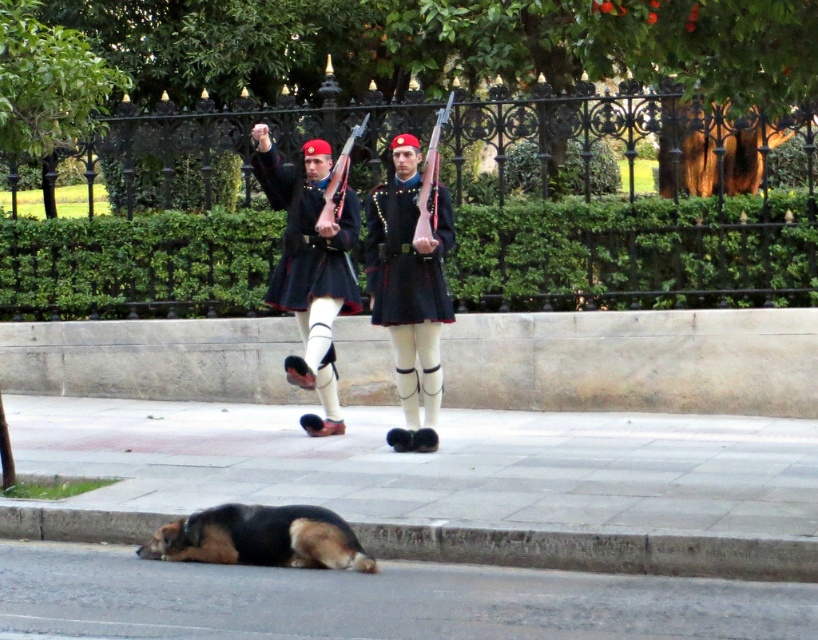
Question: Can you confirm if gray concrete curb at lower center is bigger than matte black uniform at center?

Choices:
 (A) yes
 (B) no

Answer: (B)

Question: Which of the following is the farthest from the observer?

Choices:
 (A) dark blue uniform at center
 (B) brown asphalt at lower center
 (C) brown fur dog at lower center
 (D) matte black uniform at center

Answer: (D)

Question: Which object is positioned closest to the brown fur dog at lower center?

Choices:
 (A) gray concrete curb at lower center
 (B) dark blue uniform at center
 (C) matte black uniform at center

Answer: (A)

Question: Among these objects, which one is nearest to the camera?

Choices:
 (A) matte black uniform at center
 (B) brown fur dog at lower center

Answer: (B)

Question: Is dark blue uniform at center in front of matte black uniform at center?

Choices:
 (A) yes
 (B) no

Answer: (A)

Question: Does gray concrete curb at lower center have a smaller size compared to matte black uniform at center?

Choices:
 (A) yes
 (B) no

Answer: (A)